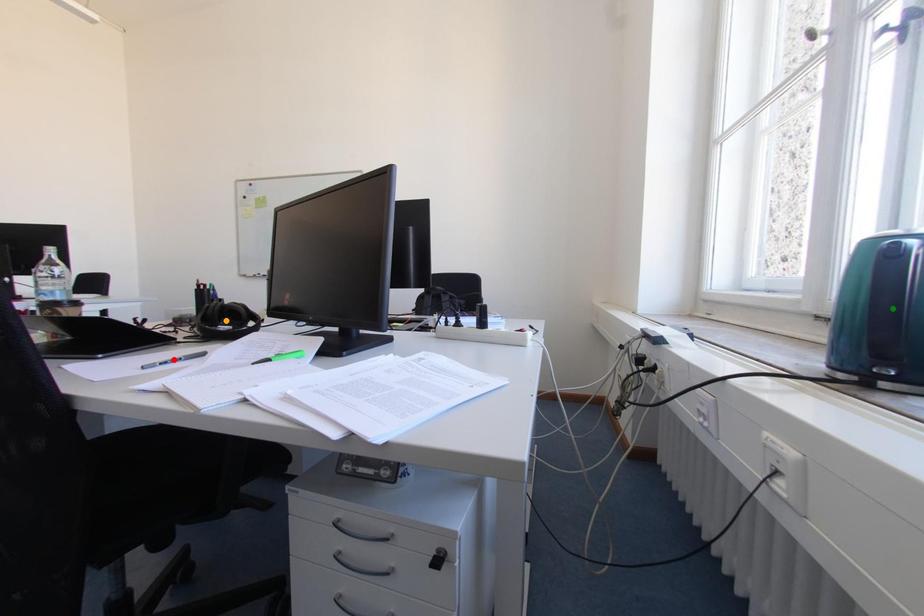
Order these from nearest to farthest:
green point | red point | orange point

green point → red point → orange point